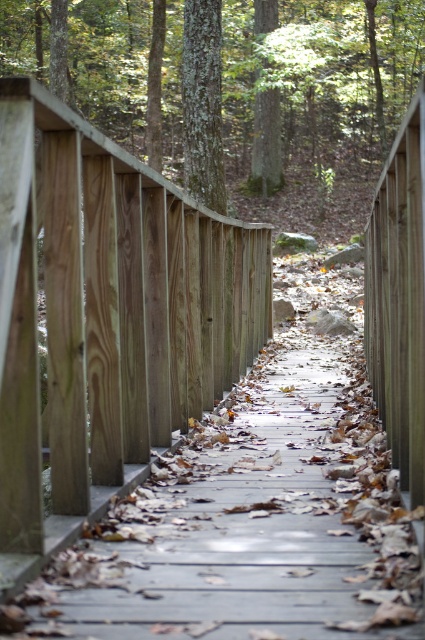
Which is in front, point (144, 476) or point (357, 54)?

Point (144, 476) is more forward.

Image resolution: width=425 pixels, height=640 pixels. What do you see at coordinates (107, 320) in the screenshot?
I see `wooden fence at center` at bounding box center [107, 320].

Identify the location of wooden fence at center. The height and width of the screenshot is (640, 425). (107, 320).

Is point (226, 144) positioned behind point (207, 198)?

Yes.

Can you confirm if smooth brown tree trunk at center is positioned above green lichen-covered tree trunk at center?

Correct, smooth brown tree trunk at center is located above green lichen-covered tree trunk at center.

The width and height of the screenshot is (425, 640). In order to click on smooth brown tree trunk at center in this screenshot , I will do `click(320, 77)`.

In order to click on smooth brown tree trunk at center in this screenshot , I will do `click(320, 77)`.

Does green lichen-covered tree trunk at center have a lesser width compared to green mossy tree at center?

Correct, green lichen-covered tree trunk at center's width is less than green mossy tree at center's.

Which is more to the left, green lichen-covered tree trunk at center or green mossy tree at center?

green lichen-covered tree trunk at center is more to the left.

Locate an element on the screen. This screenshot has height=640, width=425. green lichen-covered tree trunk at center is located at coordinates (203, 104).

Find the location of `green lichen-covered tree trunk at center`. green lichen-covered tree trunk at center is located at coordinates (203, 104).